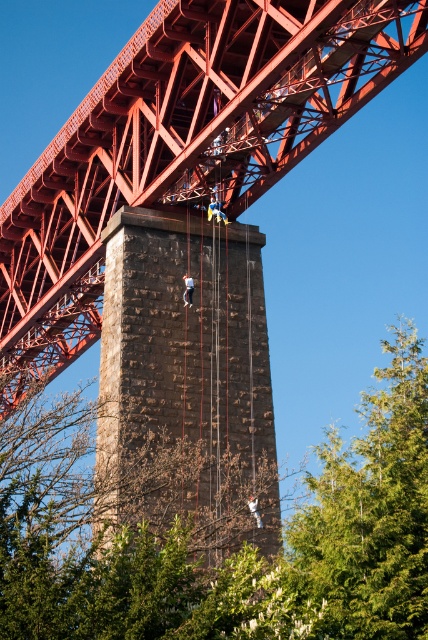
Who is shorter, red painted steel bridge at upper center or brown rough stone tower at center?

With less height is brown rough stone tower at center.

Between point (122, 54) and point (256, 532), which one is positioned behind?

The point (122, 54) is behind.

Where is `red painted steel bridge at upper center`? The width and height of the screenshot is (428, 640). red painted steel bridge at upper center is located at coordinates (181, 144).

Is green leafy tree at center positioned behind brown rough stone tower at center?

No, it is not.

Between point (363, 497) and point (237, 420), which one is positioned behind?

Positioned behind is point (237, 420).

Measure the distance between point (x=113, y=576) and camera.

They are 132.09 feet apart.

The image size is (428, 640). I want to click on green leafy tree at center, so click(x=234, y=554).

This screenshot has width=428, height=640. What do you see at coordinates (181, 144) in the screenshot?
I see `red painted steel bridge at upper center` at bounding box center [181, 144].

Measure the distance between point (x=149, y=68) and camera.

Point (x=149, y=68) and camera are 60.65 meters apart from each other.

Find the location of a particular element. This screenshot has height=640, width=428. red painted steel bridge at upper center is located at coordinates (181, 144).